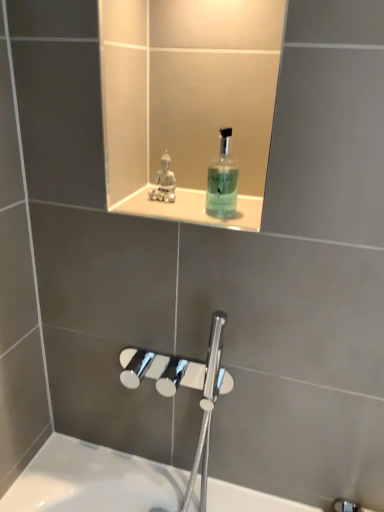
Question: Can you confirm if white glossy ledge at upper center is shorter than translucent glass mouthwash at upper center?

Choices:
 (A) yes
 (B) no

Answer: (A)

Question: Is white glossy ledge at upper center taller than translucent glass mouthwash at upper center?

Choices:
 (A) yes
 (B) no

Answer: (B)

Question: From a real-world perspective, is white glossy ledge at upper center positioned under translucent glass mouthwash at upper center based on gravity?

Choices:
 (A) no
 (B) yes

Answer: (B)

Question: Considering the relative positions of white glossy ledge at upper center and translucent glass mouthwash at upper center in the image provided, is white glossy ledge at upper center in front of translucent glass mouthwash at upper center?

Choices:
 (A) yes
 (B) no

Answer: (B)

Question: Is translucent glass mouthwash at upper center surrounded by white glossy ledge at upper center?

Choices:
 (A) no
 (B) yes

Answer: (A)

Question: Does white glossy ledge at upper center come behind translucent glass mouthwash at upper center?

Choices:
 (A) no
 (B) yes

Answer: (B)

Question: Is satin silver statue at upper center at the right side of translucent glass mouthwash at upper center?

Choices:
 (A) yes
 (B) no

Answer: (B)

Question: Is the depth of satin silver statue at upper center less than that of translucent glass mouthwash at upper center?

Choices:
 (A) yes
 (B) no

Answer: (B)

Question: Does satin silver statue at upper center lie behind translucent glass mouthwash at upper center?

Choices:
 (A) yes
 (B) no

Answer: (A)

Question: Can you confirm if satin silver statue at upper center is wider than translucent glass mouthwash at upper center?

Choices:
 (A) no
 (B) yes

Answer: (A)

Question: Is satin silver statue at upper center taller than translucent glass mouthwash at upper center?

Choices:
 (A) no
 (B) yes

Answer: (A)

Question: Is satin silver statue at upper center to the left of translucent glass mouthwash at upper center from the viewer's perspective?

Choices:
 (A) no
 (B) yes

Answer: (B)

Question: Considering the relative sizes of translucent glass mouthwash at upper center and white glossy ledge at upper center in the image provided, is translucent glass mouthwash at upper center wider than white glossy ledge at upper center?

Choices:
 (A) no
 (B) yes

Answer: (A)